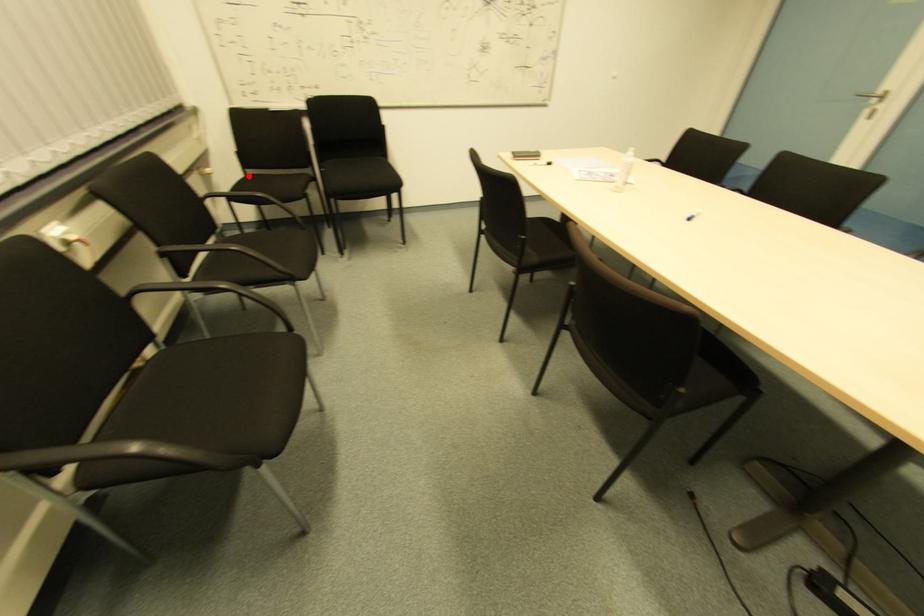
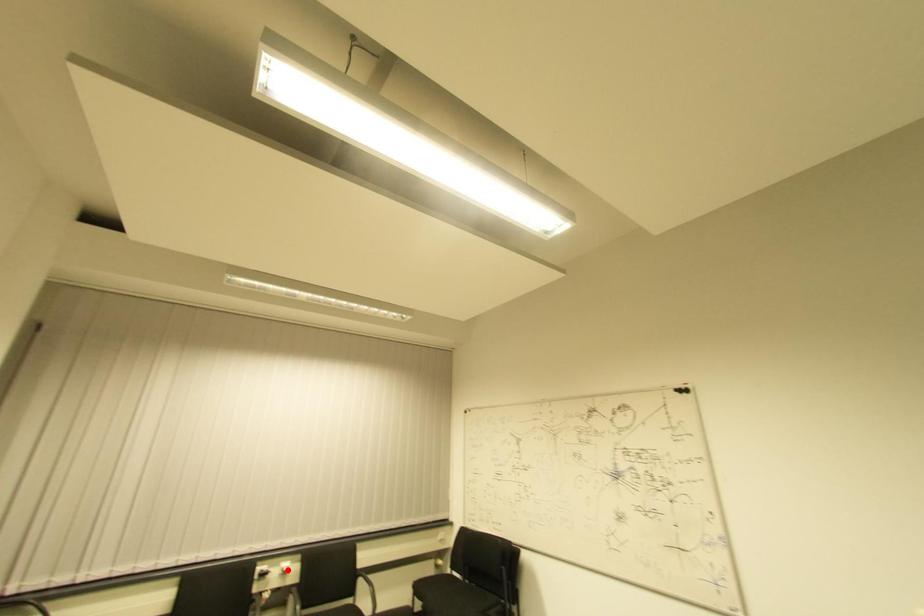
I am providing you with two images of the same scene from different viewpoints. A red point is marked on the first image and another point is marked on the second image. Is the marked point in image1 the same physical position as the marked point in image2?

No